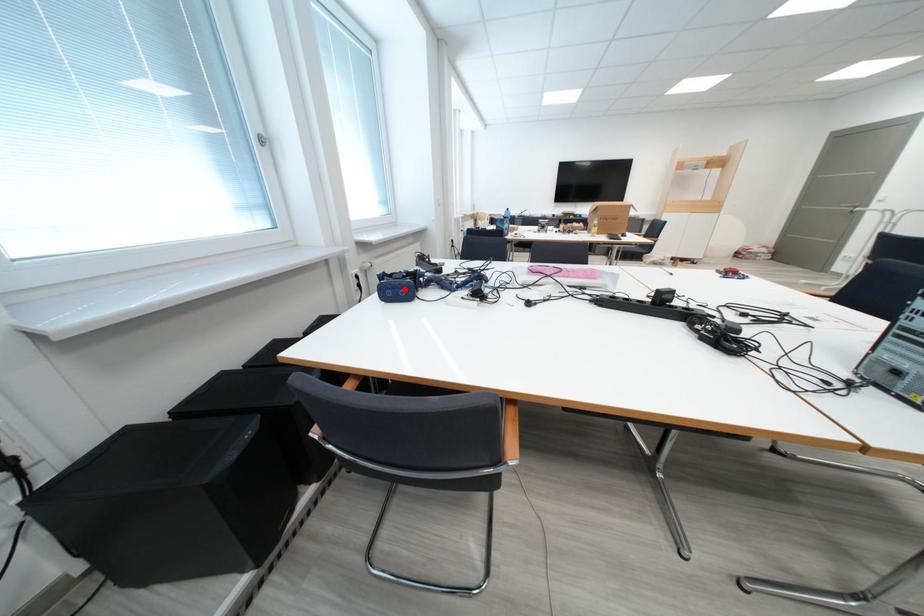
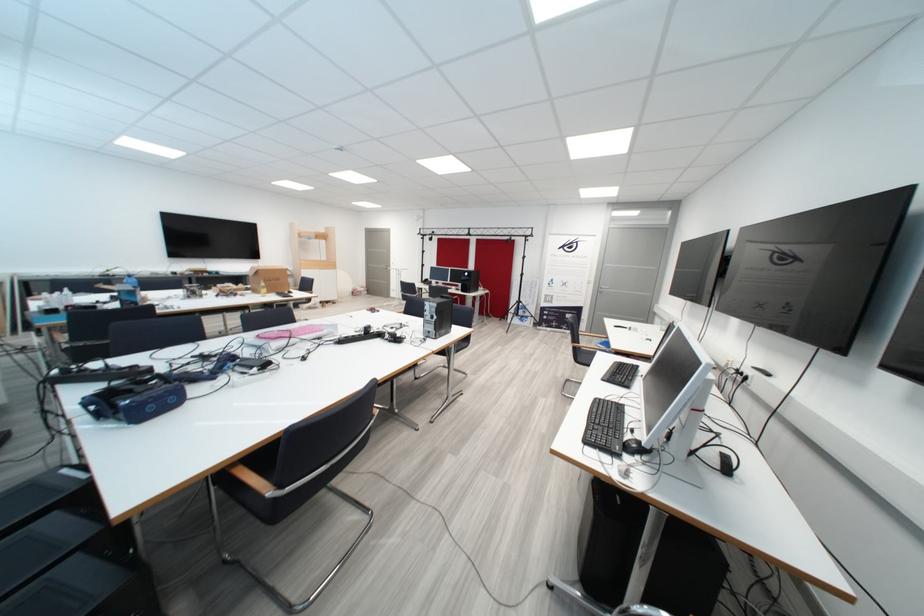
Find the pixel in the second image that matches the highlighted location in the first image.

(168, 400)